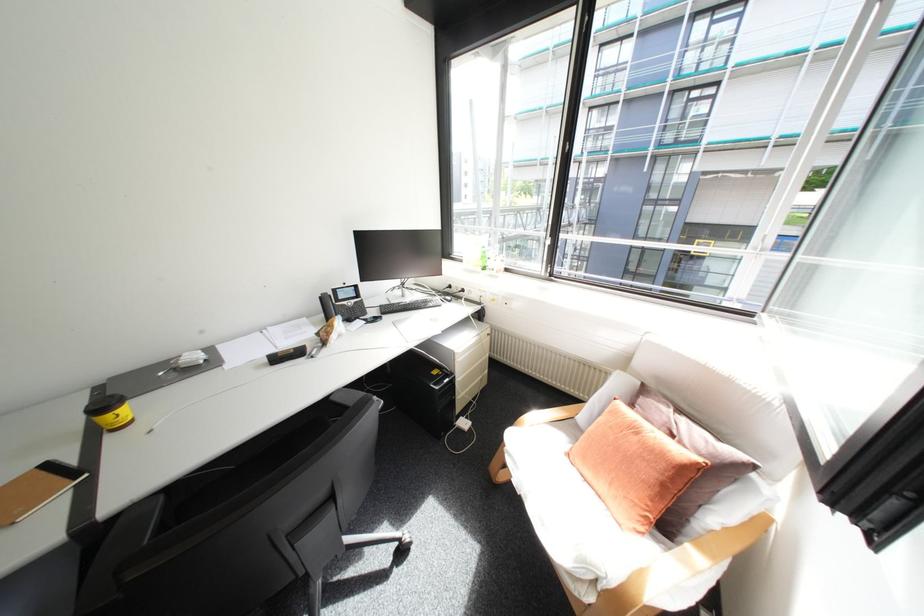
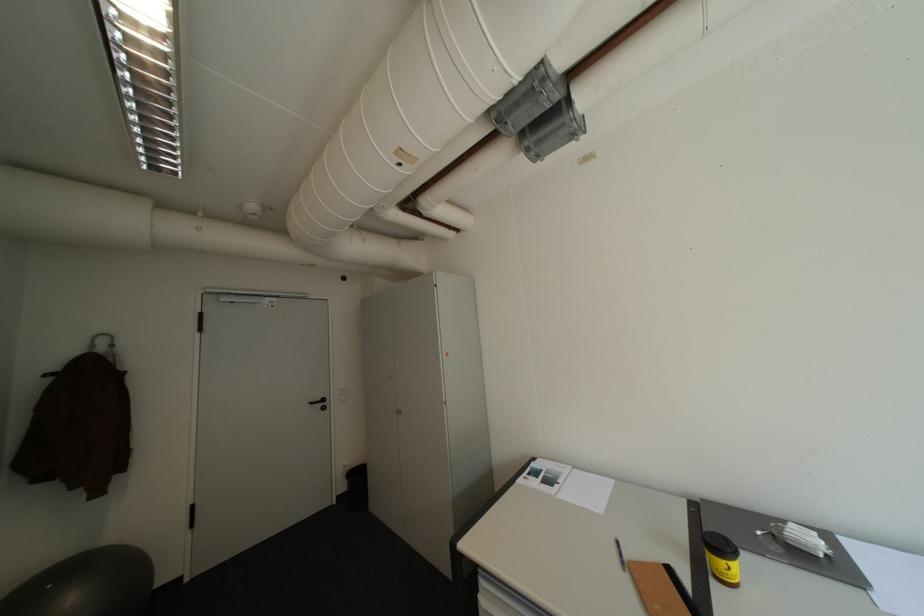
Where in the second image is the point corresponding to (x=118, y=437) from the first image?

(723, 584)